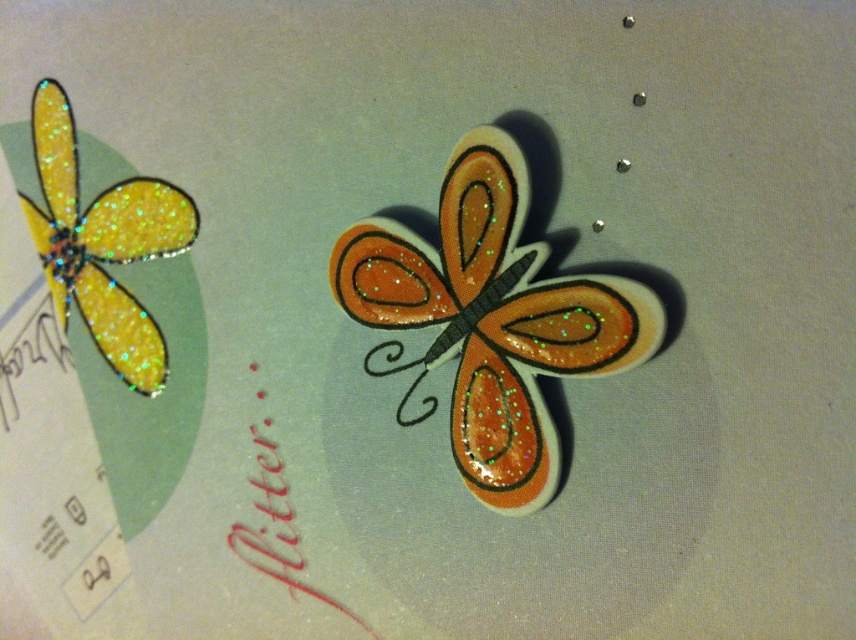
You are an interior designer arranging decorations for a party. You have two butterflies to place on a wall. The glittery orange fabric butterfly at center and the glittery yellow butterfly at upper left. According to the image, which butterfly is positioned lower on the wall?

The glittery orange fabric butterfly at center is positioned lower on the wall than the glittery yellow butterfly at upper left.

From the picture: You are an art curator examining two butterflies displayed on a light green wall. You notice the glittery orange fabric butterfly at center and the glittery yellow butterfly at upper left. Which butterfly appears closer to you?

The glittery orange fabric butterfly at center appears closer to you because it is positioned closer to the viewer compared to the glittery yellow butterfly at upper left.